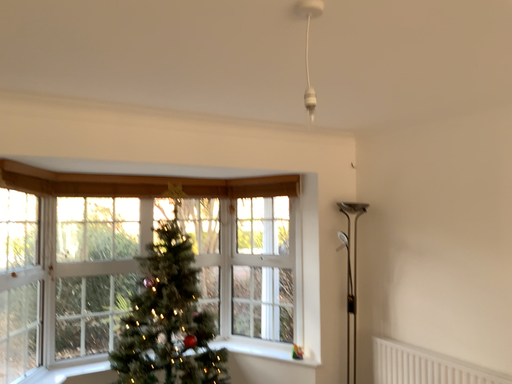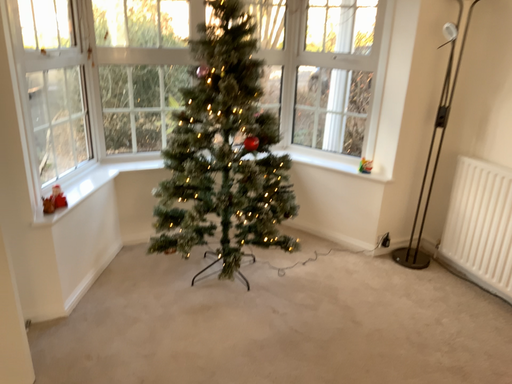
Question: How did the camera likely rotate when shooting the video?

Choices:
 (A) rotated downward
 (B) rotated upward

Answer: (A)